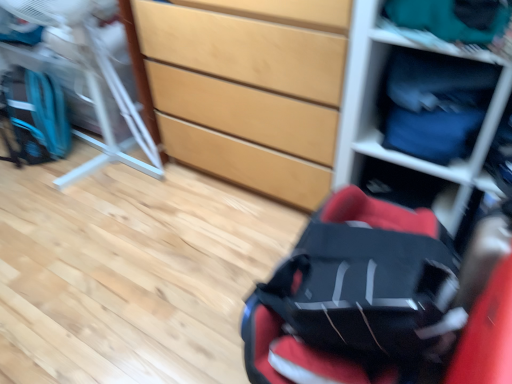
Question: Can you confirm if teal fabric at upper right is bigger than red fabric baby carriage at center?

Choices:
 (A) no
 (B) yes

Answer: (A)

Question: Is teal fabric at upper right taller than red fabric baby carriage at center?

Choices:
 (A) no
 (B) yes

Answer: (A)

Question: From a real-world perspective, is teal fabric at upper right under red fabric baby carriage at center?

Choices:
 (A) yes
 (B) no

Answer: (B)

Question: From a real-world perspective, is teal fabric at upper right over red fabric baby carriage at center?

Choices:
 (A) yes
 (B) no

Answer: (A)

Question: Is teal fabric at upper right at the left side of red fabric baby carriage at center?

Choices:
 (A) yes
 (B) no

Answer: (B)

Question: In the image, is matte plastic shelf at upper right on the left side or the right side of red fabric baby carriage at center?

Choices:
 (A) left
 (B) right

Answer: (B)

Question: Relative to red fabric baby carriage at center, is matte plastic shelf at upper right in front or behind?

Choices:
 (A) front
 (B) behind

Answer: (B)

Question: Is point (373, 135) positioned closer to the camera than point (329, 261)?

Choices:
 (A) farther
 (B) closer

Answer: (A)

Question: From the image's perspective, relative to red fabric baby carriage at center, is matte plastic shelf at upper right above or below?

Choices:
 (A) above
 (B) below

Answer: (A)

Question: Is metallic silver folding chair at left to the left or to the right of blue fabric drawer at upper right in the image?

Choices:
 (A) left
 (B) right

Answer: (A)

Question: From the image's perspective, is metallic silver folding chair at left above or below blue fabric drawer at upper right?

Choices:
 (A) above
 (B) below

Answer: (A)

Question: From a real-world perspective, is metallic silver folding chair at left physically located above or below blue fabric drawer at upper right?

Choices:
 (A) above
 (B) below

Answer: (B)

Question: Is metallic silver folding chair at left spatially inside blue fabric drawer at upper right, or outside of it?

Choices:
 (A) outside
 (B) inside

Answer: (A)

Question: Would you say teal fabric at upper right is to the left or to the right of metallic silver folding chair at left in the picture?

Choices:
 (A) left
 (B) right

Answer: (B)

Question: In the image, is teal fabric at upper right positioned in front of or behind metallic silver folding chair at left?

Choices:
 (A) behind
 (B) front

Answer: (B)